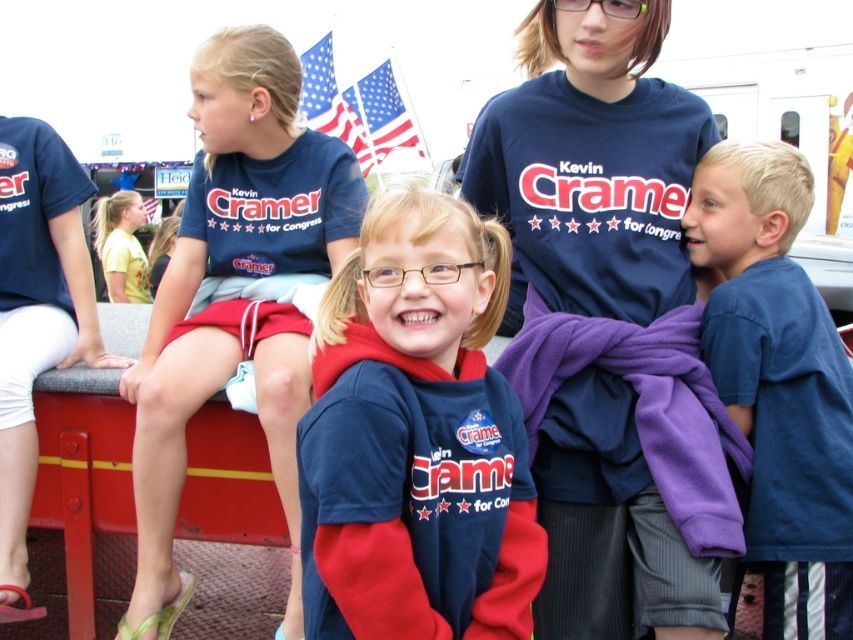
You are a photographer at the event and want to capture a photo where both the navy blue sweatshirt at center and the american flag at upper center are visible. Based on their positions, which object should appear lower in the photo?

The navy blue sweatshirt at center should appear lower in the photo because it is shorter than the american flag at upper center.